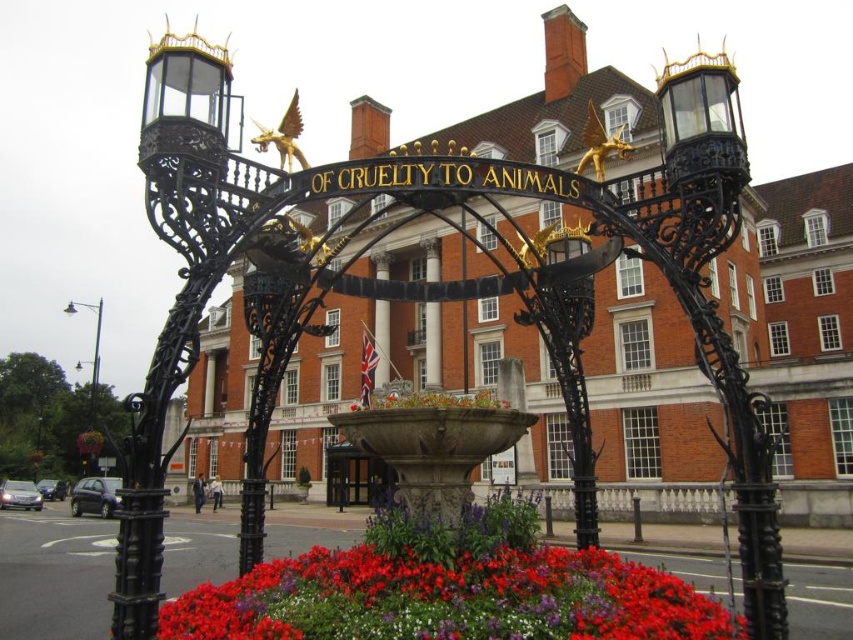
Does stone fountain at center appear under floral bouquet at center?

Correct, stone fountain at center is located below floral bouquet at center.

Who is taller, stone fountain at center or floral bouquet at center?

With more height is stone fountain at center.

Who is more forward, (453, 410) or (379, 403)?

Point (453, 410)

Image resolution: width=853 pixels, height=640 pixels. Identify the location of stone fountain at center. (434, 448).

What do you see at coordinates (434, 448) in the screenshot? This screenshot has width=853, height=640. I see `stone fountain at center` at bounding box center [434, 448].

Which is behind, point (445, 422) or point (80, 451)?

Positioned behind is point (80, 451).

Find the location of `stone fountain at center`. stone fountain at center is located at coordinates (434, 448).

The height and width of the screenshot is (640, 853). Find the location of `stone fountain at center`. stone fountain at center is located at coordinates (434, 448).

Is vivid red petals at center smaller than floral bouquet at center?

Indeed, vivid red petals at center has a smaller size compared to floral bouquet at center.

Describe the element at coordinates (450, 600) in the screenshot. I see `vivid red petals at center` at that location.

Is point (339, 550) closer to camera compared to point (496, 404)?

No, it is behind (496, 404).

This screenshot has width=853, height=640. Find the location of `vivid red petals at center`. vivid red petals at center is located at coordinates (450, 600).